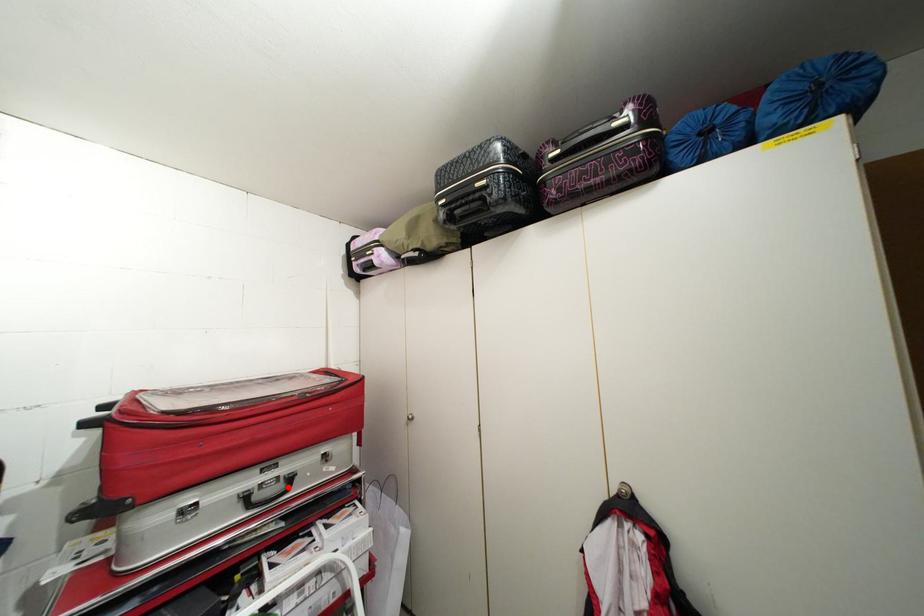
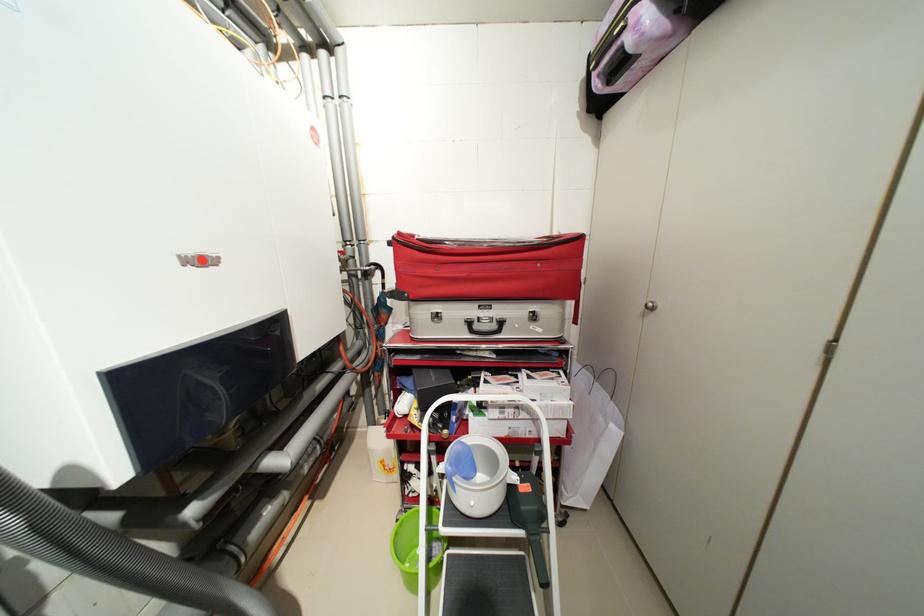
Locate, in the second image, the point that corresponds to the highlighted location in the first image.

(502, 326)